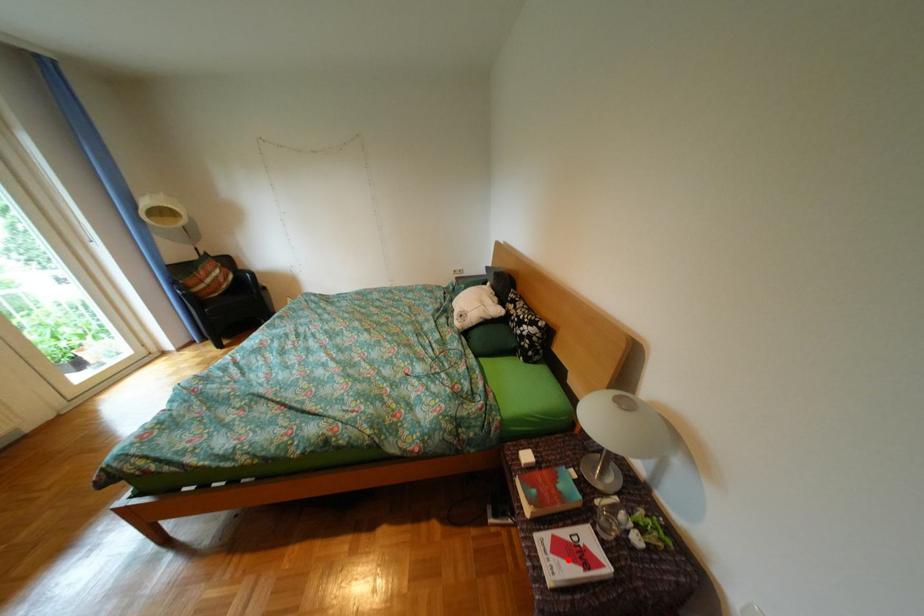
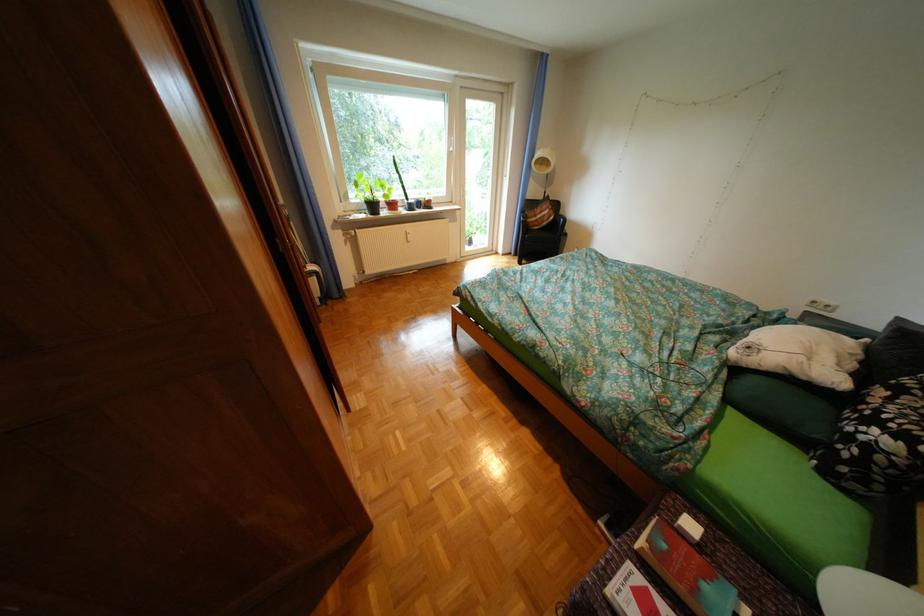
Where in the second image is the point corresponding to the highlighted location from the first image?

(642, 592)